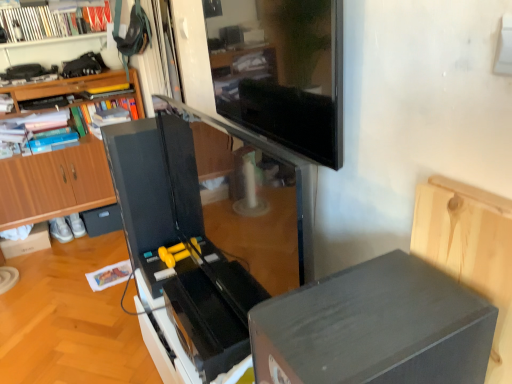
Question: Based on their positions, is white glossy bookshelf at upper left located to the left or right of matte black drawer at lower left?

Choices:
 (A) right
 (B) left

Answer: (B)

Question: From a real-world perspective, is white glossy bookshelf at upper left positioned above or below matte black drawer at lower left?

Choices:
 (A) above
 (B) below

Answer: (A)

Question: Which object is positioned farthest from the white cardboard box at lower left?

Choices:
 (A) wooden bookcase at left
 (B) white glossy bookshelf at upper left
 (C) matte black tv at upper center
 (D) matte black drawer at lower left
 (E) matte black treadmill at center

Answer: (C)

Question: Which is farther from the matte black speaker at lower right?

Choices:
 (A) white cardboard box at lower left
 (B) matte black drawer at lower left
 (C) matte black treadmill at center
 (D) matte black tv at upper center
 (E) white glossy bookshelf at upper left

Answer: (A)